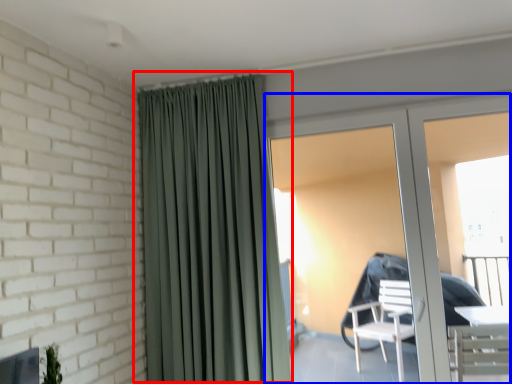
Question: Which object is further to the camera taking this photo, curtain (highlighted by a red box) or door (highlighted by a blue box)?

Choices:
 (A) curtain
 (B) door

Answer: (B)